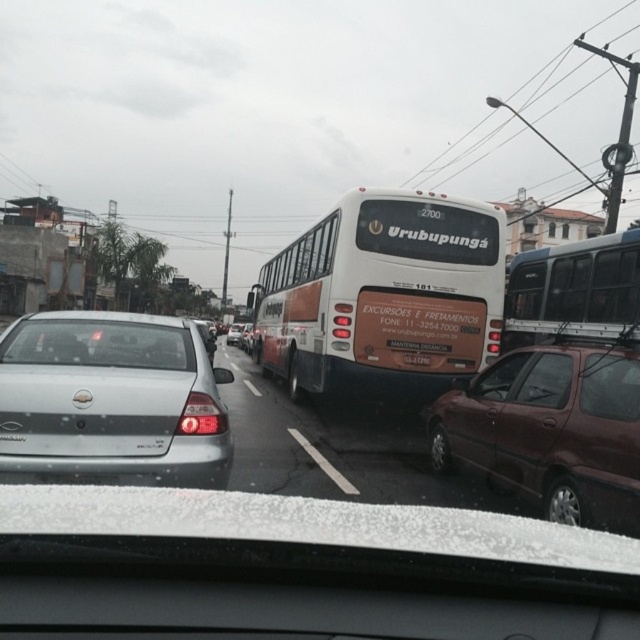
You are driving a car and see the white matte bus at center and the white matte van at right. Which one is closer to the road surface?

The white matte bus at center is closer to the road surface because it is positioned below the white matte van at right.

You are driving a car and want to pass the white matte bus at center through the clear glass windshield at center. Can you safely pass the bus without hitting it?

The white matte bus at center is wider than the clear glass windshield at center, so passing the bus through the windshield is impossible as the bus is too wide to fit within the windshield area.